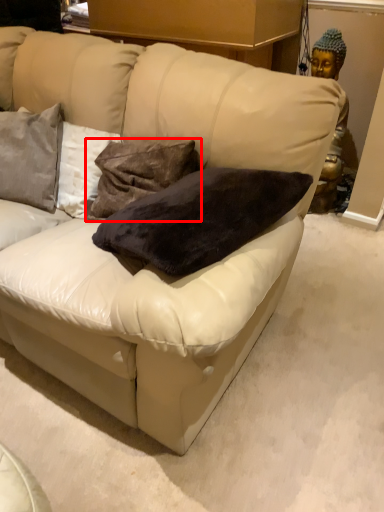
Question: From the image's perspective, where is pillow (annotated by the red box) located in relation to pillow in the image?

Choices:
 (A) below
 (B) above

Answer: (A)